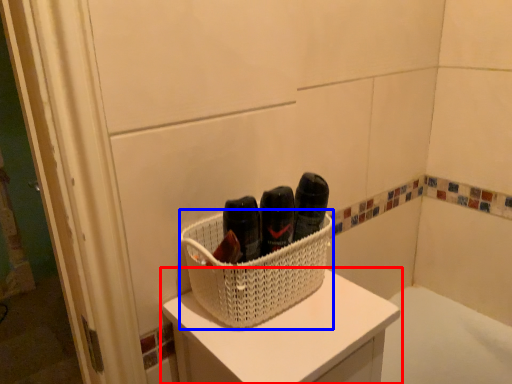
Question: Which object is further to the camera taking this photo, furniture (highlighted by a red box) or basket (highlighted by a blue box)?

Choices:
 (A) furniture
 (B) basket

Answer: (B)